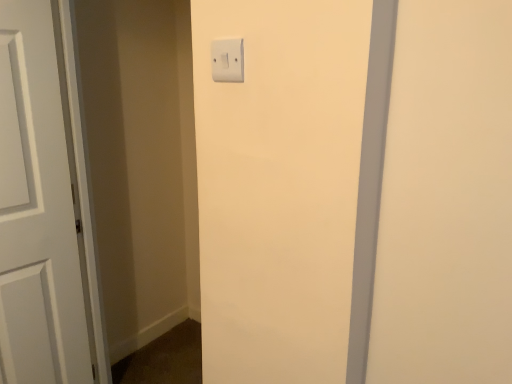
Identify the location of white matte door at left. (37, 208).

What do you see at coordinates (37, 208) in the screenshot? The image size is (512, 384). I see `white matte door at left` at bounding box center [37, 208].

What is the approximate width of white plastic light switch at upper center?

white plastic light switch at upper center is 0.73 inches in width.

The image size is (512, 384). What do you see at coordinates (227, 60) in the screenshot? I see `white plastic light switch at upper center` at bounding box center [227, 60].

You are a GUI agent. You are given a task and a screenshot of the screen. Output one action in this format:
    pyautogui.click(x=<x>, y=<y>)
    Task: Click on the white plastic light switch at upper center
    Image resolution: width=512 pixels, height=384 pixels.
    Given the screenshot: What is the action you would take?
    pyautogui.click(x=227, y=60)

Locate an element on the screen. This screenshot has height=384, width=512. white matte door at left is located at coordinates (37, 208).

Does white plastic light switch at upper center appear on the left side of white matte door at left?

No, white plastic light switch at upper center is not to the left of white matte door at left.

Considering the relative positions of white plastic light switch at upper center and white matte door at left in the image provided, is white plastic light switch at upper center behind white matte door at left?

No.

Does point (238, 52) come farther from viewer compared to point (28, 374)?

No, it is in front of (28, 374).

From the image's perspective, is white plastic light switch at upper center beneath white matte door at left?

No, from the image's perspective, white plastic light switch at upper center is not beneath white matte door at left.

From a real-world perspective, is white plastic light switch at upper center positioned over white matte door at left based on gravity?

Yes.

Does white plastic light switch at upper center have a lesser width compared to white matte door at left?

Yes, white plastic light switch at upper center is thinner than white matte door at left.

In the scene shown: Considering the relative sizes of white plastic light switch at upper center and white matte door at left in the image provided, is white plastic light switch at upper center taller than white matte door at left?

In fact, white plastic light switch at upper center may be shorter than white matte door at left.

Can you confirm if white plastic light switch at upper center is bigger than white matte door at left?

Actually, white plastic light switch at upper center might be smaller than white matte door at left.

Can white matte door at left be found inside white plastic light switch at upper center?

No.

Is white plastic light switch at upper center not near white matte door at left?

white plastic light switch at upper center is near white matte door at left, not far away.

Is white plastic light switch at upper center oriented towards white matte door at left?

No, white plastic light switch at upper center is not turned towards white matte door at left.

How different are the orientations of white plastic light switch at upper center and white matte door at left in degrees?

white plastic light switch at upper center and white matte door at left are facing 81.4 degrees away from each other.

Where is `light switch in front of the white matte door at left`? This screenshot has width=512, height=384. light switch in front of the white matte door at left is located at coordinates (227, 60).

Considering the positions of objects white matte door at left and white plastic light switch at upper center in the image provided, who is more to the right, white matte door at left or white plastic light switch at upper center?

Positioned to the right is white plastic light switch at upper center.

In the scene shown: Is white matte door at left positioned before white plastic light switch at upper center?

That is False.

Is point (22, 368) positioned before point (212, 45)?

No, (22, 368) is behind (212, 45).

From the image's perspective, is white matte door at left located above or below white plastic light switch at upper center?

Clearly, from the image's perspective, white matte door at left is below white plastic light switch at upper center.

From a real-world perspective, is white matte door at left located beneath white plastic light switch at upper center?

Yes, from a real-world perspective, white matte door at left is beneath white plastic light switch at upper center.

Is white matte door at left thinner than white plastic light switch at upper center?

In fact, white matte door at left might be wider than white plastic light switch at upper center.

Who is taller, white matte door at left or white plastic light switch at upper center?

With more height is white matte door at left.

Is white matte door at left bigger than white plastic light switch at upper center?

Yes.

Is white matte door at left not inside white plastic light switch at upper center?

Yes, white matte door at left is not within white plastic light switch at upper center.

Is white matte door at left far away from white plastic light switch at upper center?

Actually, white matte door at left and white plastic light switch at upper center are a little close together.

Does white matte door at left turn towards white plastic light switch at upper center?

Yes, white matte door at left is turned towards white plastic light switch at upper center.

At what (x,y) coordinates should I click in order to perform the action: click on door that is on the left side of white plastic light switch at upper center. Please return your answer as a coordinate pair (x, y). The height and width of the screenshot is (384, 512). Looking at the image, I should click on (37, 208).

Find the location of a particular element. The height and width of the screenshot is (384, 512). door directly beneath the white plastic light switch at upper center (from a real-world perspective) is located at coordinates (37, 208).

Identify the location of light switch that appears above the white matte door at left (from a real-world perspective). The height and width of the screenshot is (384, 512). (227, 60).